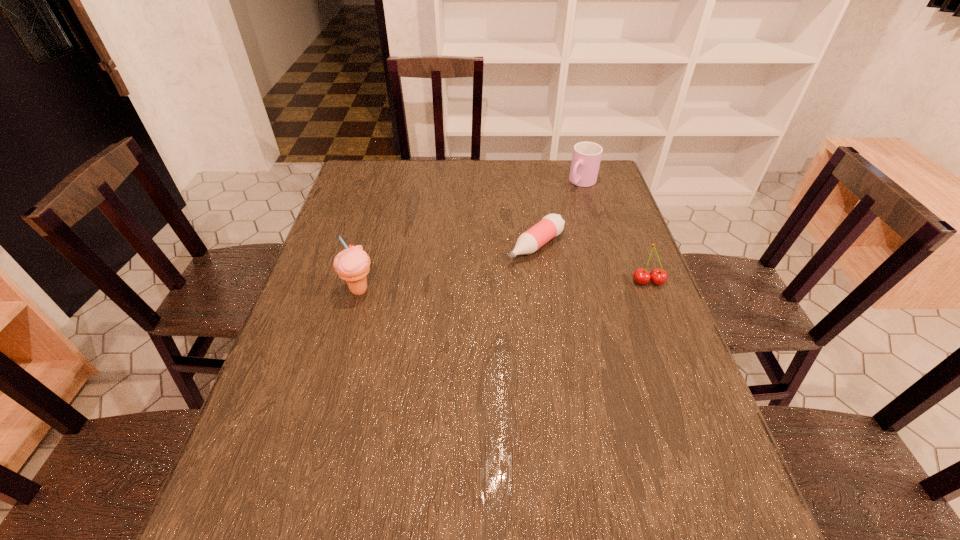
Identify the location of unoccupied position between the leftmost object and the second farthest object. The width and height of the screenshot is (960, 540). pos(447,268).

Where is `free space between the leftmost object and the farthest object`? Image resolution: width=960 pixels, height=540 pixels. free space between the leftmost object and the farthest object is located at coordinates (x=470, y=237).

Identify the location of free point between the leftmost object and the shortest object. (447, 268).

Locate which object is the third closest to the tallest object. Please provide its 2D coordinates. Your answer should be formatted as a tuple, i.e. [(x, y)], where the tuple contains the x and y coordinates of a point satisfying the conditions above.

[(586, 157)]

What are the coordinates of `object that stands as the second closest to the rightmost object` in the screenshot? It's located at (586, 157).